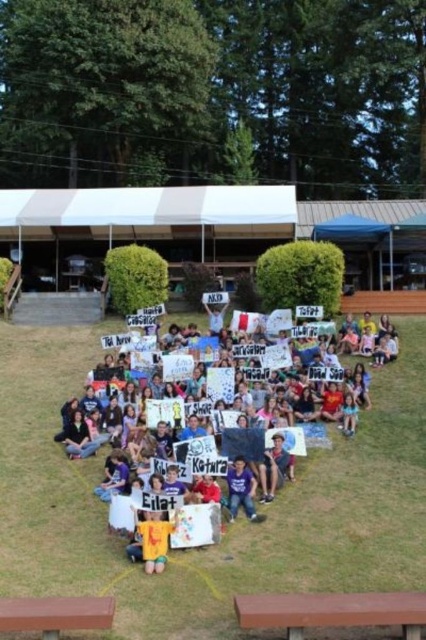
Measure the distance between brown wood picnic table at lower left and purple cotton shirt at center.

brown wood picnic table at lower left is 7.39 meters away from purple cotton shirt at center.

Between point (86, 628) and point (238, 460), which one is positioned in front?

Point (86, 628)

This screenshot has width=426, height=640. What do you see at coordinates (55, 614) in the screenshot?
I see `brown wood picnic table at lower left` at bounding box center [55, 614].

Find the location of a particular element. This screenshot has width=426, height=640. brown wood picnic table at lower left is located at coordinates (55, 614).

Does multicolored paper signs at center have a larger size compared to brown wood picnic table at lower left?

Yes.

Does point (164, 422) come closer to viewer compared to point (103, 627)?

No, it is not.

Who is more distant from viewer, (106,493) or (19,604)?

The point (106,493) is more distant.

Find the location of a particular element. The image size is (426, 640). multicolored paper signs at center is located at coordinates (212, 417).

Can you confirm if multicolored paper signs at center is smaller than brown wood picnic table at lower center?

Actually, multicolored paper signs at center might be larger than brown wood picnic table at lower center.

Who is more distant from viewer, (115,481) or (259,608)?

Positioned behind is point (115,481).

Between point (227, 348) and point (325, 616), which one is positioned behind?

The point (227, 348) is behind.

Locate an element on the screen. Image resolution: width=426 pixels, height=640 pixels. multicolored paper signs at center is located at coordinates (212, 417).